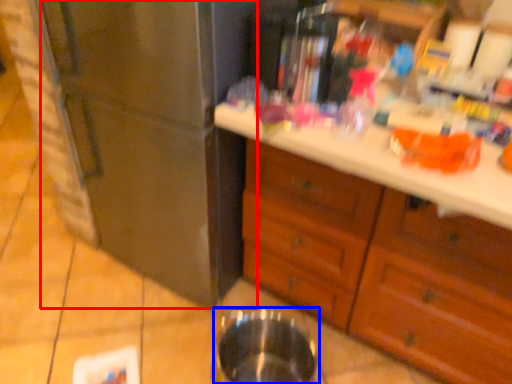
Question: Which object appears closest to the camera in this image, refrigerator (highlighted by a red box) or basin (highlighted by a blue box)?

Choices:
 (A) refrigerator
 (B) basin

Answer: (A)